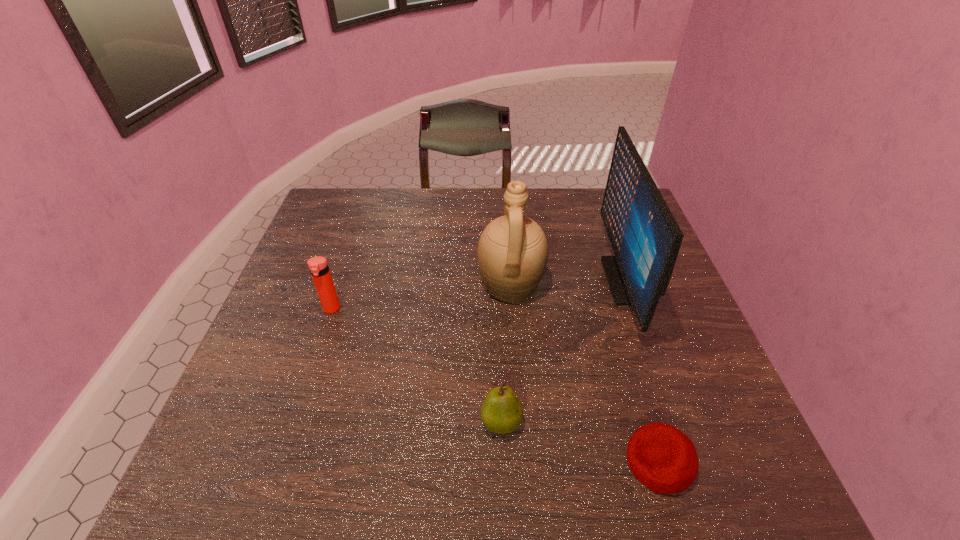
Where is `computer monitor`? computer monitor is located at coordinates (645, 237).

Identify the location of pitcher. Image resolution: width=960 pixels, height=540 pixels. click(x=512, y=252).

Locate an element on the screen. thermos bottle is located at coordinates (318, 266).

This screenshot has height=540, width=960. I want to click on the third shortest object, so click(318, 266).

I want to click on pear, so click(501, 412).

Locate an element on the screen. beanbag is located at coordinates (664, 459).

Find the location of a particular element. The image size is (960, 540). vacant region located 0.070m on the screen side of the computer monitor is located at coordinates (582, 280).

You are a GUI agent. You are given a task and a screenshot of the screen. Output one action in this format:
    pyautogui.click(x=<x>, y=<y>)
    Task: Click on the vacant area located on the screen side of the computer monitor
    This screenshot has width=960, height=540.
    Given the screenshot: What is the action you would take?
    pyautogui.click(x=548, y=280)

Image resolution: width=960 pixels, height=540 pixels. I want to click on free spot located on the screen side of the computer monitor, so click(530, 280).

Find the location of `vacant space situated on the back of the pitcher`. vacant space situated on the back of the pitcher is located at coordinates (504, 193).